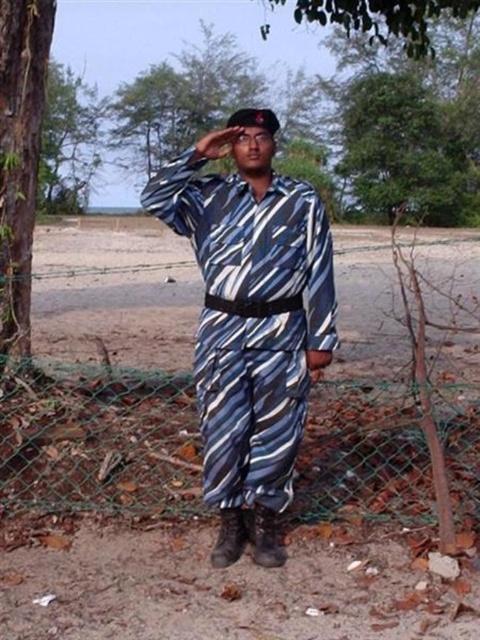
You are a photographer trying to capture a wide shot of the scene. You notice the green wire mesh fence at lower right and the green leafy tree at upper left. Which object should you position closer to the edge of your frame to avoid cutting off part of the other object?

You should position the green wire mesh fence at lower right closer to the edge of your frame because it is on the right side of the green leafy tree at upper left, so placing it near the edge will ensure the tree remains fully visible.

You are standing at the center of the image and want to walk towards the green wire mesh fence at lower right. In which direction should you move?

You should move towards the lower right direction to reach the green wire mesh fence at lower right.

You are a painter who wants to set up an easel between the green wire mesh fence at lower right and the blue striped uniform at center. The easel requires at least 1 meter of space. Can you fit it there?

The green wire mesh fence at lower right is wider than the blue striped uniform at center. However, the exact distance between them isn not specified in the description. Therefore, it is uncertain if there is enough space for the easel.